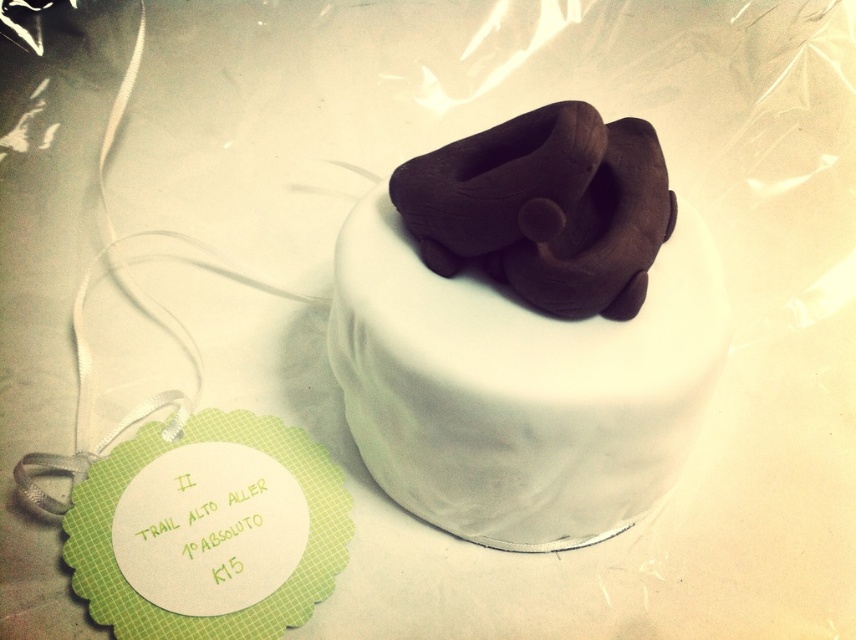
Question: Is the position of white smooth cake at center more distant than that of chocolate matte at center?

Choices:
 (A) yes
 (B) no

Answer: (A)

Question: Is white smooth cake at center below chocolate matte at center?

Choices:
 (A) no
 (B) yes

Answer: (B)

Question: Does white smooth cake at center appear over chocolate matte at center?

Choices:
 (A) yes
 (B) no

Answer: (B)

Question: Which point is closer to the camera?

Choices:
 (A) (678, 403)
 (B) (513, 209)

Answer: (B)

Question: Among these points, which one is farthest from the camera?

Choices:
 (A) (498, 275)
 (B) (642, 257)

Answer: (A)